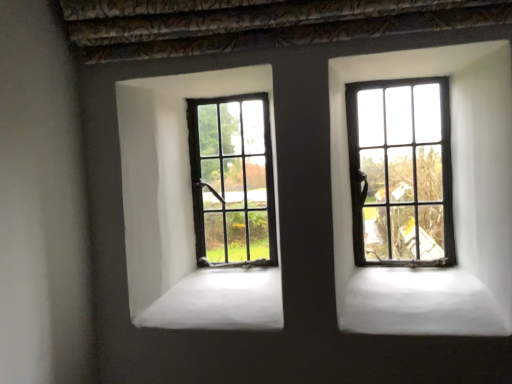
Question: Could you tell me if matte black window at right, which is the 2th window in back-to-front order, is turned towards matte black window at center, the 2th window from the front?

Choices:
 (A) yes
 (B) no

Answer: (B)

Question: Is matte black window at right, which is the 2th window in back-to-front order, closer to the viewer compared to matte black window at center, the 2th window from the front?

Choices:
 (A) yes
 (B) no

Answer: (A)

Question: Is matte black window at right, positioned as the first window in front-to-back order, in contact with matte black window at center, the second window positioned from the right?

Choices:
 (A) yes
 (B) no

Answer: (B)

Question: Can you confirm if matte black window at right, positioned as the first window in right-to-left order, is thinner than matte black window at center, the 2th window from the front?

Choices:
 (A) yes
 (B) no

Answer: (B)

Question: Is matte black window at right, positioned as the first window in right-to-left order, smaller than matte black window at center, marked as the 1th window in a back-to-front arrangement?

Choices:
 (A) no
 (B) yes

Answer: (A)

Question: Is the position of matte black window at right, positioned as the first window in right-to-left order, more distant than that of matte black window at center, the second window positioned from the right?

Choices:
 (A) yes
 (B) no

Answer: (B)

Question: Is matte black window at center, the 2th window from the front, to the right of matte black window at right, which ranks as the second window in left-to-right order, from the viewer's perspective?

Choices:
 (A) yes
 (B) no

Answer: (B)

Question: From the image's perspective, is matte black window at center, positioned as the first window in left-to-right order, on matte black window at right, which ranks as the second window in left-to-right order?

Choices:
 (A) yes
 (B) no

Answer: (B)

Question: Can you confirm if matte black window at center, the 2th window from the front, is thinner than matte black window at right, which ranks as the second window in left-to-right order?

Choices:
 (A) no
 (B) yes

Answer: (B)

Question: Would you consider matte black window at center, the second window positioned from the right, to be distant from matte black window at right, which is the 2th window in back-to-front order?

Choices:
 (A) no
 (B) yes

Answer: (A)

Question: Considering the relative sizes of matte black window at center, the 2th window from the front, and matte black window at right, positioned as the first window in right-to-left order, in the image provided, is matte black window at center, the 2th window from the front, wider than matte black window at right, positioned as the first window in right-to-left order,?

Choices:
 (A) yes
 (B) no

Answer: (B)

Question: Would you say matte black window at center, positioned as the first window in left-to-right order, is outside matte black window at right, positioned as the first window in right-to-left order?

Choices:
 (A) yes
 (B) no

Answer: (A)

Question: Does point (368, 180) appear closer or farther from the camera than point (273, 195)?

Choices:
 (A) closer
 (B) farther

Answer: (A)